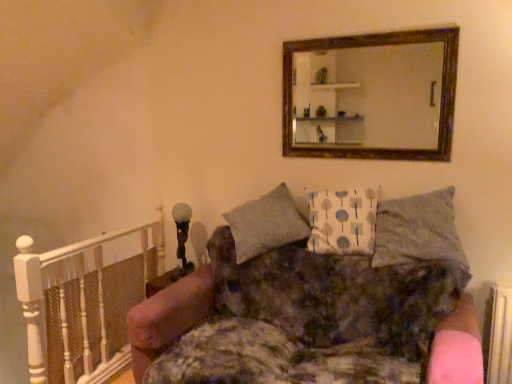
At what (x,y) coordinates should I click in order to perform the action: click on velvet floral couch at center. Please return your answer as a coordinate pair (x, y). Looking at the image, I should click on (168, 317).

This screenshot has width=512, height=384. Find the location of `wooden frame mirror at upper center`. wooden frame mirror at upper center is located at coordinates (369, 96).

Identify the location of white painted wood balustrade at left. This screenshot has height=384, width=512. (84, 305).

Measure the distance between point (x=23, y=272) and camera.

The distance of point (x=23, y=272) from camera is 6.63 feet.

Where is `textured gray pillow at upper right, marked as the first pillow in a right-to-left arrangement`? The width and height of the screenshot is (512, 384). textured gray pillow at upper right, marked as the first pillow in a right-to-left arrangement is located at coordinates (421, 233).

You are a GUI agent. You are given a task and a screenshot of the screen. Output one action in this format:
    pyautogui.click(x=<x>, y=<y>)
    Task: Click on the white fabric pillow at center, which appears as the 2th pillow when viewed from the right
    The image size is (512, 384).
    Given the screenshot: What is the action you would take?
    pyautogui.click(x=342, y=221)

How much distance is there between velvet floral couch at center and white fabric pillow at center, the 1th pillow in the left-to-right sequence?

They are 30.80 inches apart.

Does velvet floral couch at center turn towards white fabric pillow at center, which appears as the 2th pillow when viewed from the right?

No, velvet floral couch at center does not turn towards white fabric pillow at center, which appears as the 2th pillow when viewed from the right.

From a real-world perspective, which is physically below, velvet floral couch at center or white fabric pillow at center, which appears as the 2th pillow when viewed from the right?

From a 3D spatial view, velvet floral couch at center is below.

Image resolution: width=512 pixels, height=384 pixels. I want to click on studio couch below the white fabric pillow at center, the 1th pillow in the left-to-right sequence (from the image's perspective), so click(x=168, y=317).

How far apart are wooden frame mirror at upper center and textured gray pillow at upper right, marked as the first pillow in a right-to-left arrangement?

They are 20.29 inches apart.

Does wooden frame mirror at upper center have a lesser width compared to textured gray pillow at upper right, acting as the 2th pillow starting from the left?

Correct, the width of wooden frame mirror at upper center is less than that of textured gray pillow at upper right, acting as the 2th pillow starting from the left.

Considering the positions of points (387, 57) and (381, 243), is point (387, 57) farther from camera compared to point (381, 243)?

Yes, point (387, 57) is farther from viewer.

Which of these two, wooden frame mirror at upper center or textured gray pillow at upper right, acting as the 2th pillow starting from the left, stands shorter?

textured gray pillow at upper right, acting as the 2th pillow starting from the left.

Which of these two, textured gray pillow at upper right, acting as the 2th pillow starting from the left, or velvet floral couch at center, is wider?

velvet floral couch at center.

Between point (417, 231) and point (433, 364), which one is positioned behind?

Point (417, 231)

From the image's perspective, which object appears higher, textured gray pillow at upper right, acting as the 2th pillow starting from the left, or velvet floral couch at center?

From the image's view, textured gray pillow at upper right, acting as the 2th pillow starting from the left, is above.

Is textured gray pillow at upper right, marked as the first pillow in a right-to-left arrangement, spatially inside velvet floral couch at center, or outside of it?

textured gray pillow at upper right, marked as the first pillow in a right-to-left arrangement, is located beyond the bounds of velvet floral couch at center.

From the image's perspective, does velvet floral couch at center appear higher than wooden frame mirror at upper center?

No, from the image's perspective, velvet floral couch at center is not above wooden frame mirror at upper center.

Can you confirm if velvet floral couch at center is taller than wooden frame mirror at upper center?

Yes, velvet floral couch at center is taller than wooden frame mirror at upper center.

Is velvet floral couch at center touching wooden frame mirror at upper center?

No, velvet floral couch at center is not beside wooden frame mirror at upper center.

What's the angular difference between velvet floral couch at center and wooden frame mirror at upper center's facing directions?

0.0494 degrees.

Find the location of a particular element. pillow above the textured gray pillow at upper right, acting as the 2th pillow starting from the left (from the image's perspective) is located at coordinates 342,221.

Between point (447, 202) and point (331, 192), which one is positioned behind?

The point (331, 192) is farther from the camera.

Who is smaller, textured gray pillow at upper right, marked as the first pillow in a right-to-left arrangement, or white fabric pillow at center, which appears as the 2th pillow when viewed from the right?

white fabric pillow at center, which appears as the 2th pillow when viewed from the right, is smaller.

Which object is thinner, textured gray pillow at upper right, marked as the first pillow in a right-to-left arrangement, or white fabric pillow at center, which appears as the 2th pillow when viewed from the right?

Thinner between the two is white fabric pillow at center, which appears as the 2th pillow when viewed from the right.

Is white painted wood balustrade at left oriented away from white fabric pillow at center, which appears as the 2th pillow when viewed from the right?

Correct, white painted wood balustrade at left is looking away from white fabric pillow at center, which appears as the 2th pillow when viewed from the right.

Is point (118, 314) closer to viewer compared to point (365, 216)?

No, (118, 314) is further to viewer.

Can you tell me how much white painted wood balustrade at left and white fabric pillow at center, the 1th pillow in the left-to-right sequence, differ in facing direction?

The facing directions of white painted wood balustrade at left and white fabric pillow at center, the 1th pillow in the left-to-right sequence, are 81.9 degrees apart.

Is white painted wood balustrade at left positioned beyond the bounds of white fabric pillow at center, which appears as the 2th pillow when viewed from the right?

white painted wood balustrade at left is positioned outside white fabric pillow at center, which appears as the 2th pillow when viewed from the right.

Considering the positions of objects white painted wood balustrade at left and wooden frame mirror at upper center in the image provided, who is more to the right, white painted wood balustrade at left or wooden frame mirror at upper center?

From the viewer's perspective, wooden frame mirror at upper center appears more on the right side.

From the image's perspective, is white painted wood balustrade at left on wooden frame mirror at upper center?

No, from the image's perspective, white painted wood balustrade at left is not on top of wooden frame mirror at upper center.

Is wooden frame mirror at upper center surrounded by white painted wood balustrade at left?

No, wooden frame mirror at upper center is located outside of white painted wood balustrade at left.

Are white painted wood balustrade at left and wooden frame mirror at upper center far apart?

Yes, white painted wood balustrade at left and wooden frame mirror at upper center are quite far apart.

Where is `studio couch located in front of the white fabric pillow at center, the 1th pillow in the left-to-right sequence`? This screenshot has width=512, height=384. studio couch located in front of the white fabric pillow at center, the 1th pillow in the left-to-right sequence is located at coordinates (168, 317).

This screenshot has width=512, height=384. What are the coordinates of `mirror lying on the left of textured gray pillow at upper right, marked as the first pillow in a right-to-left arrangement` in the screenshot? It's located at (369, 96).

Considering their positions, is velvet floral couch at center positioned further to textured gray pillow at upper right, marked as the first pillow in a right-to-left arrangement, than wooden frame mirror at upper center?

Based on the image, velvet floral couch at center appears to be further to textured gray pillow at upper right, marked as the first pillow in a right-to-left arrangement.

From the image, which object appears to be nearer to white painted wood balustrade at left, velvet floral couch at center or wooden frame mirror at upper center?

Based on the image, velvet floral couch at center appears to be nearer to white painted wood balustrade at left.

Considering their positions, is wooden frame mirror at upper center positioned closer to textured gray pillow at upper right, acting as the 2th pillow starting from the left, than white painted wood balustrade at left?

Among the two, wooden frame mirror at upper center is located nearer to textured gray pillow at upper right, acting as the 2th pillow starting from the left.

Which object lies further to the anchor point white fabric pillow at center, the 1th pillow in the left-to-right sequence, wooden frame mirror at upper center or velvet floral couch at center?

Based on the image, velvet floral couch at center appears to be further to white fabric pillow at center, the 1th pillow in the left-to-right sequence.

Estimate the real-world distances between objects in this image. Which object is further from white fabric pillow at center, which appears as the 2th pillow when viewed from the right, textured gray pillow at upper right, marked as the first pillow in a right-to-left arrangement, or wooden frame mirror at upper center?

wooden frame mirror at upper center.

Looking at this image, when comparing their distances from wooden frame mirror at upper center, does white fabric pillow at center, the 1th pillow in the left-to-right sequence, or velvet floral couch at center seem further?

Among the two, velvet floral couch at center is located further to wooden frame mirror at upper center.

Which object lies nearer to the anchor point textured gray pillow at upper right, marked as the first pillow in a right-to-left arrangement, velvet floral couch at center or white painted wood balustrade at left?

velvet floral couch at center.

Looking at the image, which one is located further to white fabric pillow at center, which appears as the 2th pillow when viewed from the right, white painted wood balustrade at left or wooden frame mirror at upper center?

white painted wood balustrade at left is further to white fabric pillow at center, which appears as the 2th pillow when viewed from the right.

Where is `pillow between wooden frame mirror at upper center and textured gray pillow at upper right, acting as the 2th pillow starting from the left, in the vertical direction`? This screenshot has height=384, width=512. pillow between wooden frame mirror at upper center and textured gray pillow at upper right, acting as the 2th pillow starting from the left, in the vertical direction is located at coordinates (342, 221).

This screenshot has width=512, height=384. Identify the location of studio couch situated between white painted wood balustrade at left and white fabric pillow at center, which appears as the 2th pillow when viewed from the right, from left to right. (168, 317).

The width and height of the screenshot is (512, 384). Find the location of `pillow between white painted wood balustrade at left and wooden frame mirror at upper center from left to right`. pillow between white painted wood balustrade at left and wooden frame mirror at upper center from left to right is located at coordinates [x=342, y=221].

Identify the location of pillow between white painted wood balustrade at left and textured gray pillow at upper right, acting as the 2th pillow starting from the left, from left to right. The image size is (512, 384). (342, 221).